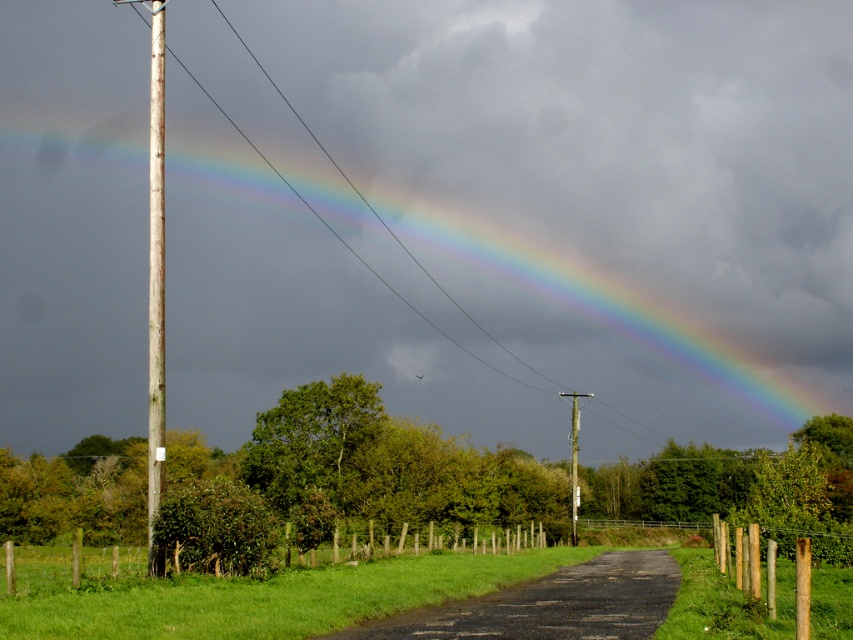
You are standing on the road in the image and want to take a photo of the rainbow at upper center and the weathered wood pole at left. Which object should you focus on first to ensure both are in the frame?

You should focus on the weathered wood pole at left first because it is closer to you than the rainbow at upper center, ensuring both are in the frame.

You are a photographer trying to capture the rainbow at upper center and the weathered wood pole at left in the same frame. Given that your camera can only focus on objects within a 150 cm width, will both fit in the frame?

The rainbow at upper center is wider than the weathered wood pole at left. Since the camera can focus on objects within a 150 cm width, both objects can fit as long as their combined width doesn

You are a photographer standing on the road in the center of the image. You want to capture a photo that includes both the rainbow at upper center and the weathered wood pole at left. Based on their positions, which object should appear higher in the photo?

The rainbow at upper center is above the weathered wood pole at left, so it will appear higher in the photo.